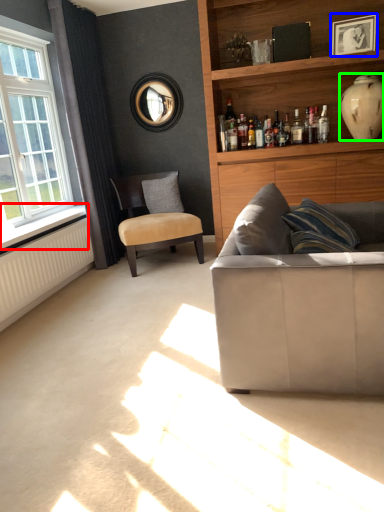
Question: Which is farther away from window sill (highlighted by a red box)? picture frame (highlighted by a blue box) or vase (highlighted by a green box)?

Choices:
 (A) picture frame
 (B) vase

Answer: (A)